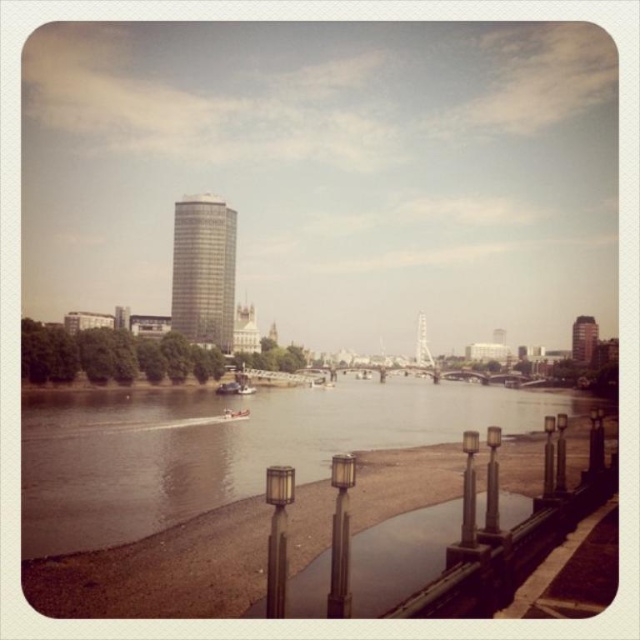
Who is more forward, [177,484] or [179,320]?

Point [177,484]

Does brown water at center have a lesser height compared to silver glass tower at center?

Correct, brown water at center is not as tall as silver glass tower at center.

Which is behind, point (230, 486) or point (211, 209)?

Positioned behind is point (211, 209).

This screenshot has height=640, width=640. In order to click on brown water at center in this screenshot , I will do click(x=225, y=448).

Is silver glass tower at center shorter than metallic glass tower at upper right?

No, silver glass tower at center is not shorter than metallic glass tower at upper right.

Who is more forward, (224, 326) or (589, 362)?

Positioned in front is point (224, 326).

This screenshot has height=640, width=640. Find the location of `silver glass tower at center`. silver glass tower at center is located at coordinates (204, 269).

Locate an element on the screen. silver glass tower at center is located at coordinates (204, 269).

Does brown water at center appear on the right side of metallic glass tower at upper right?

Incorrect, brown water at center is not on the right side of metallic glass tower at upper right.

Is point (244, 451) positioned behind point (577, 332)?

No, (244, 451) is in front of (577, 332).

The image size is (640, 640). In order to click on brown water at center in this screenshot , I will do `click(225, 448)`.